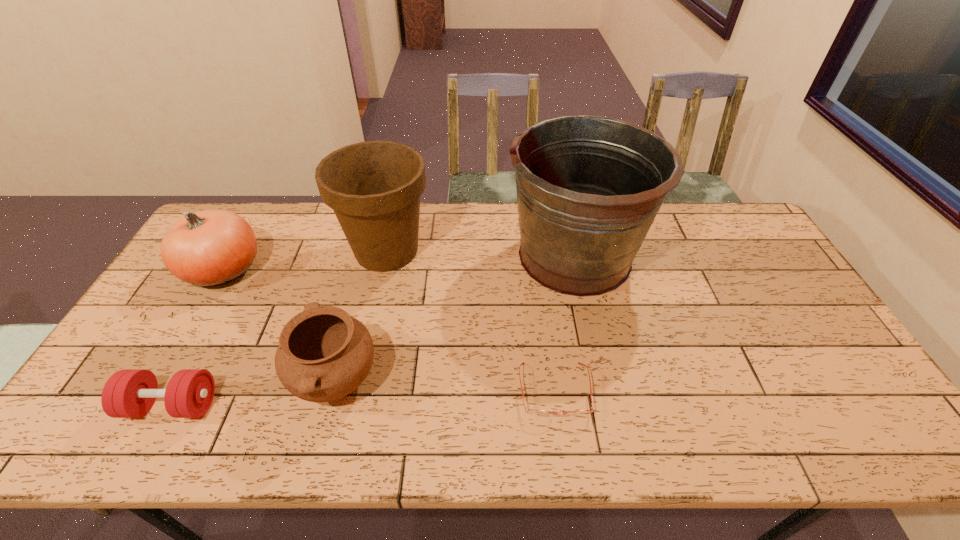
Locate an element on the screen. object present at the far left corner is located at coordinates (207, 248).

Where is `object present at the near left corner`? object present at the near left corner is located at coordinates (130, 393).

You are a GUI agent. You are given a task and a screenshot of the screen. Output one action in this format:
    pyautogui.click(x=<x>, y=<y>)
    Task: Click on the free space at the far edge
    The height and width of the screenshot is (540, 960).
    Given the screenshot: What is the action you would take?
    pyautogui.click(x=297, y=214)

Where is `vacant region at the near edge of the desktop`? Image resolution: width=960 pixels, height=540 pixels. vacant region at the near edge of the desktop is located at coordinates pyautogui.click(x=570, y=442).

In the image, there is a desktop. Identify the location of vacant space at the left edge. The height and width of the screenshot is (540, 960). (144, 355).

At what (x,y) coordinates should I click in order to perform the action: click on free region at the right edge of the desktop. Please return your answer as a coordinate pair (x, y). This screenshot has width=960, height=540. Looking at the image, I should click on (749, 285).

You are a GUI agent. You are given a task and a screenshot of the screen. Output one action in this format:
    pyautogui.click(x=<x>, y=<y>)
    Task: Click on the free space at the far left corner of the desktop
    
    Given the screenshot: What is the action you would take?
    pyautogui.click(x=225, y=208)

Locate an element on the screen. The image size is (960, 540). vacant space at the far right corner of the desktop is located at coordinates (700, 203).

At what (x,y) coordinates should I click in order to perform the action: click on vacant space that is in between the shortest object and the dumbbell. Please return your answer as a coordinate pair (x, y). Image resolution: width=960 pixels, height=540 pixels. Looking at the image, I should click on (363, 398).

You are a GUI agent. You are given a task and a screenshot of the screen. Output one action in this format:
    pyautogui.click(x=<x>, y=<y>)
    Task: Click on the empty space between the dumbbell and the fourth tallest object
    
    Given the screenshot: What is the action you would take?
    pyautogui.click(x=253, y=393)